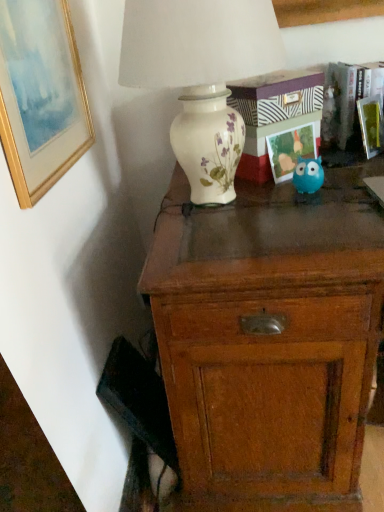
You are a GUI agent. You are given a task and a screenshot of the screen. Output one action in this format:
    pyautogui.click(x=<x>, y=<y>)
    Task: Click on the free space to the right of blue rubber toy at center
    This screenshot has width=384, height=512.
    Given the screenshot: What is the action you would take?
    pyautogui.click(x=348, y=181)